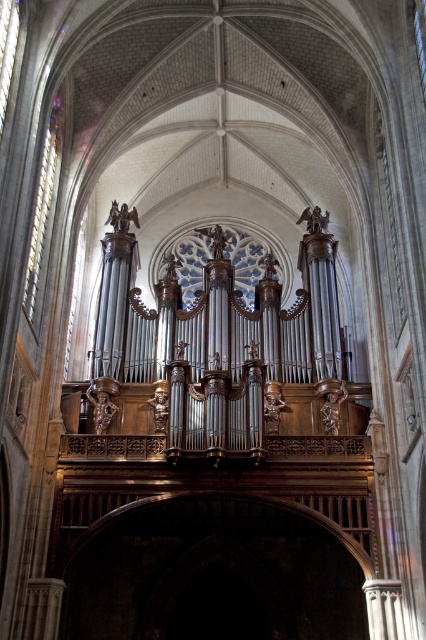
You are an architect inspecting the cathedral. You notice the transparent stained glass at center and the clear glass window at left. Which one is located lower in the cathedral?

The transparent stained glass at center is positioned under the clear glass window at left, so it is located lower in the cathedral.

You are standing in the grand cathedral and want to locate the transparent stained glass at center. According to the coordinates provided, where should you look?

The transparent stained glass at center is located at coordinates point (244, 260).

You are an architect designing a new cathedral and want to replicate the rose window and a smaller window from the image. Which of the two windows, the transparent stained glass at center or the clear glass window at left, should you make wider to match the original design?

The transparent stained glass at center should be made wider because it might be wider than the clear glass window at left according to the description.